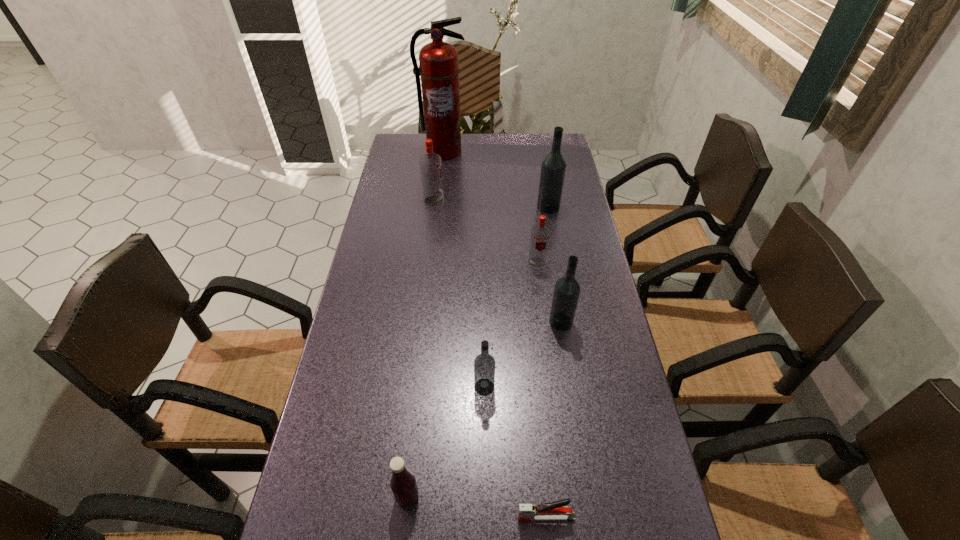
Where is `free spot between the stapler and the second biggest black vodka`? The height and width of the screenshot is (540, 960). free spot between the stapler and the second biggest black vodka is located at coordinates click(553, 420).

You are a GUI agent. You are given a task and a screenshot of the screen. Output one action in this format:
    pyautogui.click(x=<x>, y=<y>)
    Task: Click on the free spot between the gray stapler and the farthest object
    
    Given the screenshot: What is the action you would take?
    pyautogui.click(x=494, y=334)

Image resolution: width=960 pixels, height=540 pixels. What are the coordinates of `blank region between the second nearest black vodka and the fourth vodka from right to left` in the screenshot? It's located at (522, 355).

The width and height of the screenshot is (960, 540). Identify the location of object that stands as the second closest to the fifth farthest object. (484, 364).

Locate which object is the fourth closest to the bigger red vodka. Please provide its 2D coordinates. Your answer should be formatted as a tuple, i.e. [(x, y)], where the tuple contains the x and y coordinates of a point satisfying the conditions above.

[(566, 293)]

I want to click on vodka that is the fourth closest to the sixth farthest object, so click(x=430, y=163).

Find the location of a particular element. This screenshot has height=540, width=960. vodka that is the closest to the fourth nearest object is located at coordinates (540, 234).

The image size is (960, 540). Find the location of `black vodka that is the second closest to the nearest vodka`. black vodka that is the second closest to the nearest vodka is located at coordinates (553, 168).

The image size is (960, 540). What are the coordinates of `the second closest black vodka relative to the gray stapler` in the screenshot? It's located at (566, 293).

This screenshot has width=960, height=540. Identify the location of free spot that satisfies the following two spatial constraints: 1. on the nozzle side of the Tabasco sauce; 2. on the left side of the fire extinguisher. (406, 496).